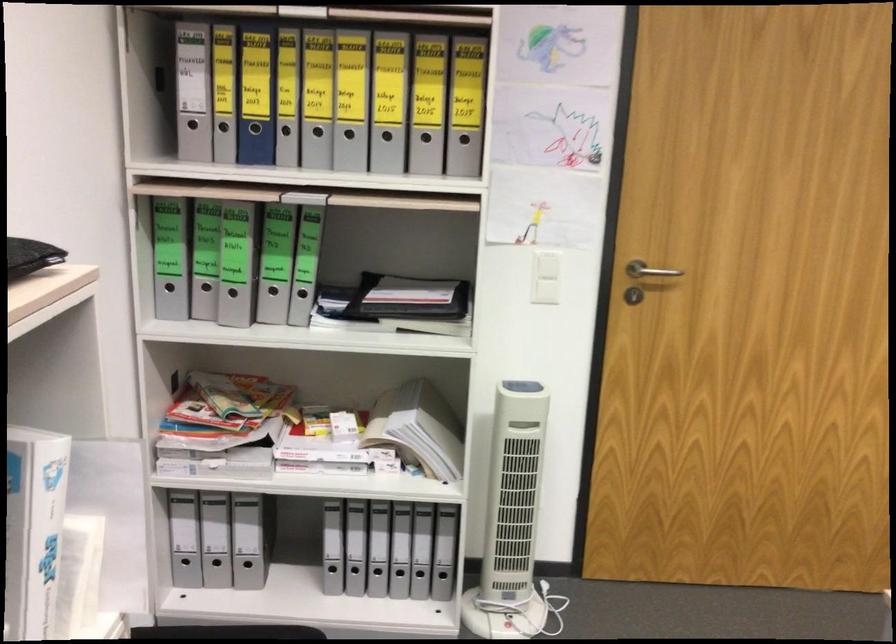
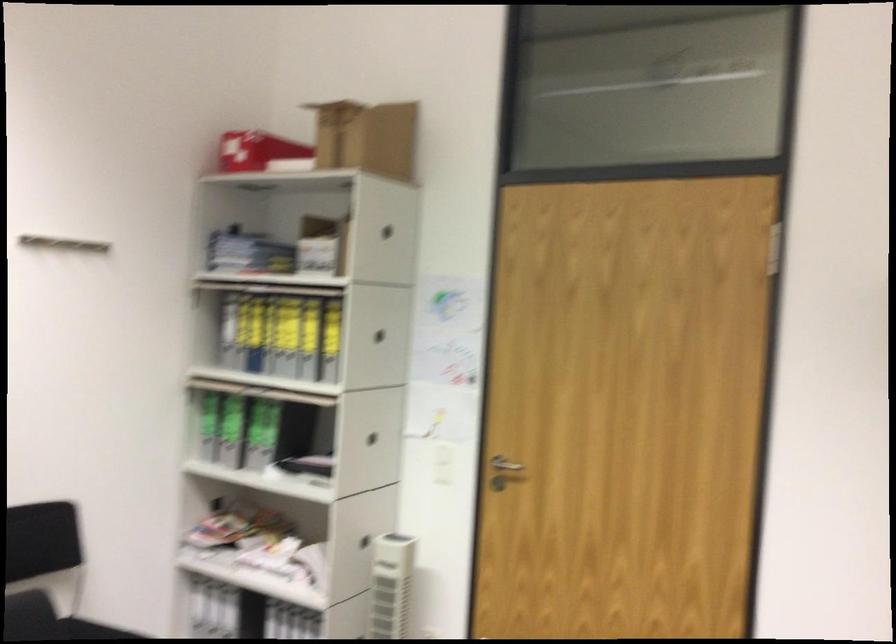
In the second image, find the point that corresponds to (x=297, y=298) in the first image.

(265, 453)